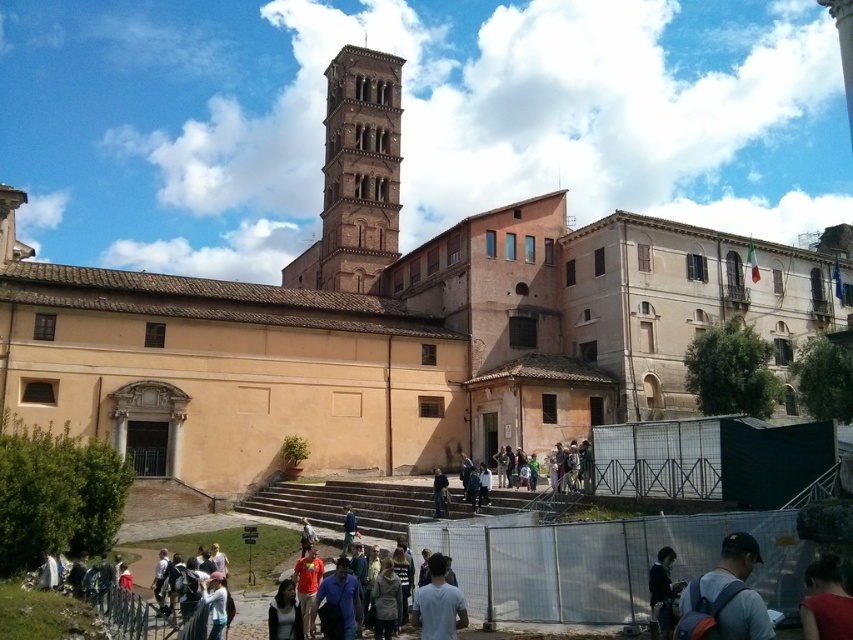
Can you confirm if red fabric dress at lower right is positioned to the right of dark blue jeans at center?

Indeed, red fabric dress at lower right is positioned on the right side of dark blue jeans at center.

Locate an element on the screen. The image size is (853, 640). red fabric dress at lower right is located at coordinates 825,602.

Is point (817, 605) farther from viewer compared to point (433, 497)?

No, it is not.

Identify the location of red fabric dress at lower right. Image resolution: width=853 pixels, height=640 pixels. (825, 602).

Who is more forward, (x=688, y=621) or (x=666, y=618)?

Point (x=688, y=621)

What do you see at coordinates (724, 596) in the screenshot? This screenshot has width=853, height=640. I see `matte blue backpack at lower right` at bounding box center [724, 596].

Is point (764, 632) farther from viewer compared to point (647, 580)?

No, (764, 632) is closer to viewer.

Where is `matte blue backpack at lower right`? Image resolution: width=853 pixels, height=640 pixels. matte blue backpack at lower right is located at coordinates (724, 596).

Which of these two, beige stone church at center or matte blue backpack at lower right, stands taller?

Standing taller between the two is beige stone church at center.

Can you confirm if beige stone church at center is bigger than matte blue backpack at lower right?

Yes.

Between point (468, 440) and point (751, 600), which one is positioned in front?

Point (751, 600) is more forward.

You are a GUI agent. You are given a task and a screenshot of the screen. Output one action in this format:
    pyautogui.click(x=<x>, y=<y>)
    Task: Click on the beige stone church at center
    The width and height of the screenshot is (853, 640).
    Given the screenshot: What is the action you would take?
    pyautogui.click(x=392, y=324)